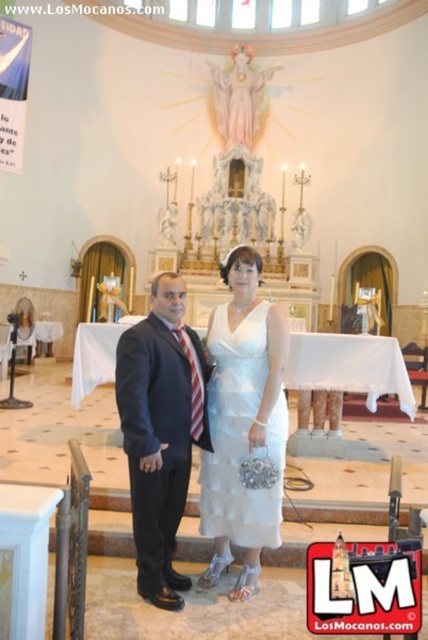
Question: Is the position of matte black suit at center less distant than that of white satin dress at center?

Choices:
 (A) no
 (B) yes

Answer: (B)

Question: Which of the following is the closest to the observer?

Choices:
 (A) (172, 419)
 (B) (220, 413)

Answer: (A)

Question: Which point is farther to the camera?

Choices:
 (A) (255, 378)
 (B) (189, 433)

Answer: (A)

Question: Can you confirm if matte black suit at center is smaller than white satin dress at center?

Choices:
 (A) no
 (B) yes

Answer: (A)

Question: Is matte black suit at center below white satin dress at center?

Choices:
 (A) yes
 (B) no

Answer: (B)